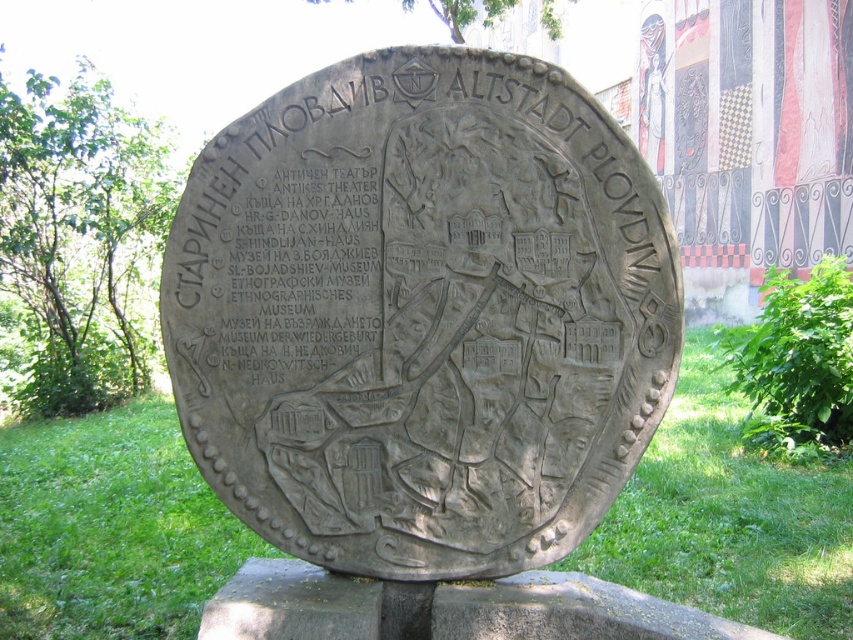
Can you confirm if gray stone plaque at center is positioned below green grass at lower center?

Incorrect, gray stone plaque at center is not positioned below green grass at lower center.

Locate an element on the screen. This screenshot has width=853, height=640. gray stone plaque at center is located at coordinates coord(421,314).

In order to click on gray stone plaque at center in this screenshot , I will do `click(421, 314)`.

Locate an element on the screen. Image resolution: width=853 pixels, height=640 pixels. gray stone plaque at center is located at coordinates (421, 314).